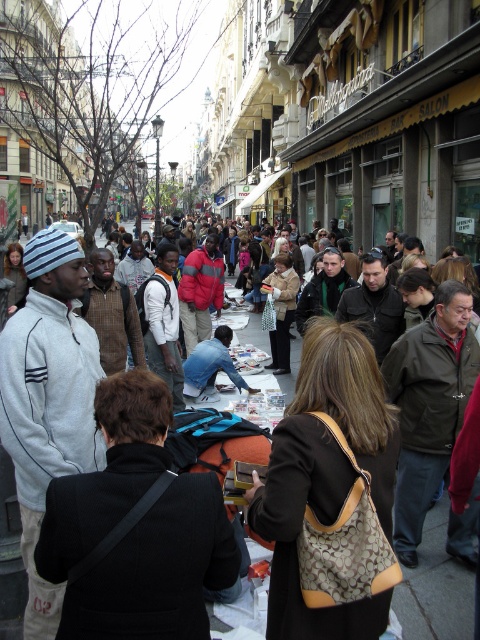
You are a vendor at the market and need to arrange two jackets on a narrow shelf. The white fleece jacket at left and the dark brown leather jacket at center are the only items. Which jacket should you place first to ensure both fit on the shelf?

The white fleece jacket at left occupies less space than the dark brown leather jacket at center, so place the white fleece jacket at left first to make room for the larger dark brown leather jacket at center.

You are standing at the center of the market and want to reach the white fleece jacket at left. Which direction should you move to get there?

The white fleece jacket at left is located at point 0.627 on the x axis and 0.100 on the y axis. Since you are at the center, you should move to the left and slightly forward to reach it.